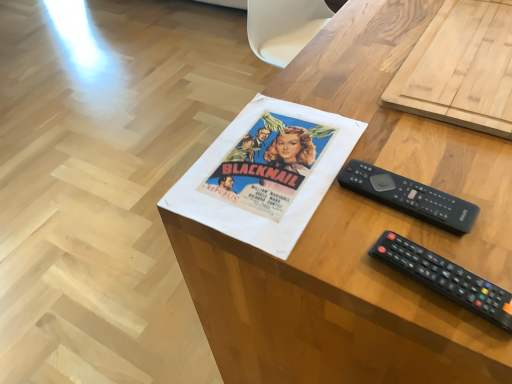
At what (x,y) coordinates should I click in order to perform the action: click on vacant region to the left of black plastic remote at lower right, positioned as the first remote control in bottom-to-top order. Please return your answer as a coordinate pair (x, y). Image resolution: width=512 pixels, height=384 pixels. Looking at the image, I should click on (318, 254).